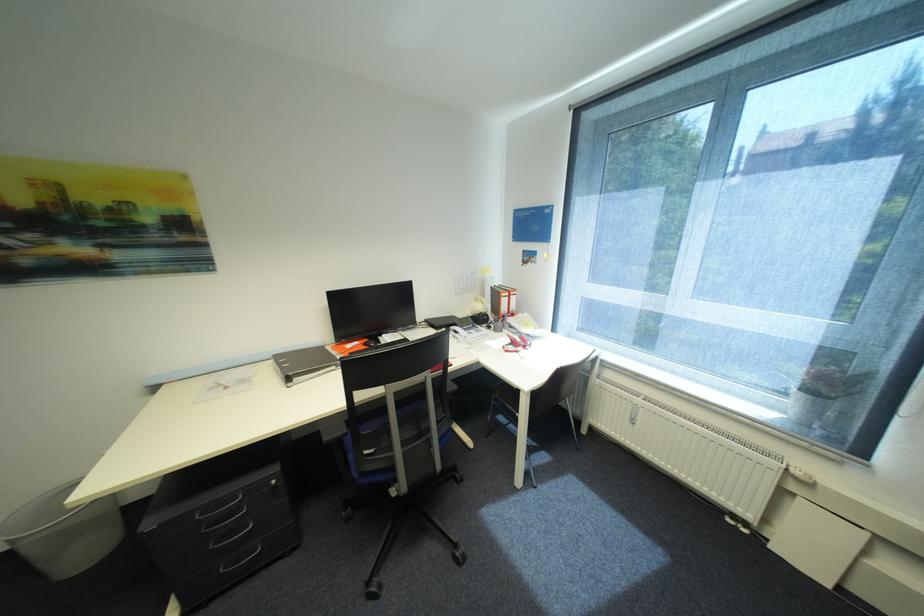
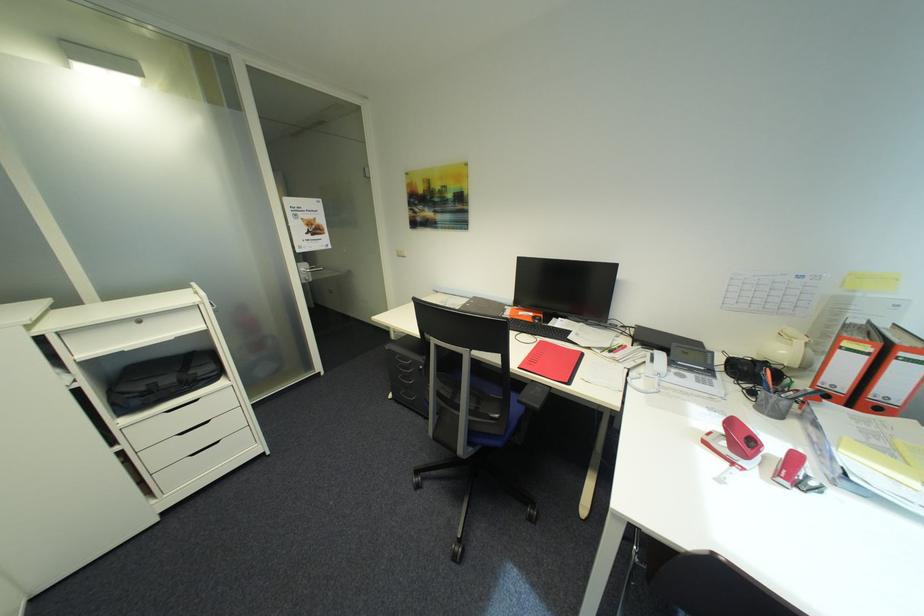
Locate, in the second image, the point that corresponds to point 496,328 in the first image.

(760, 392)